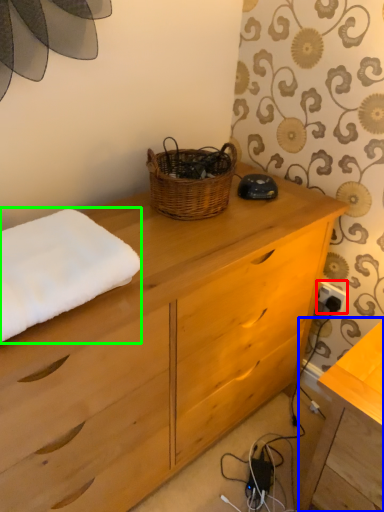
Question: Which object is the closest to the electric outlet (highlighted by a red box)? Choose among these: table (highlighted by a blue box) or bath towel (highlighted by a green box).

Choices:
 (A) table
 (B) bath towel

Answer: (A)